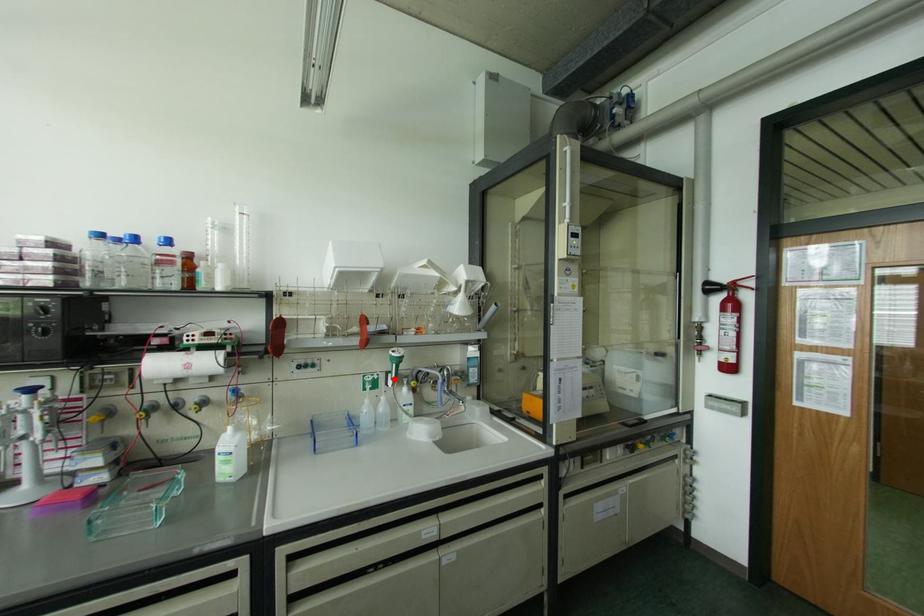
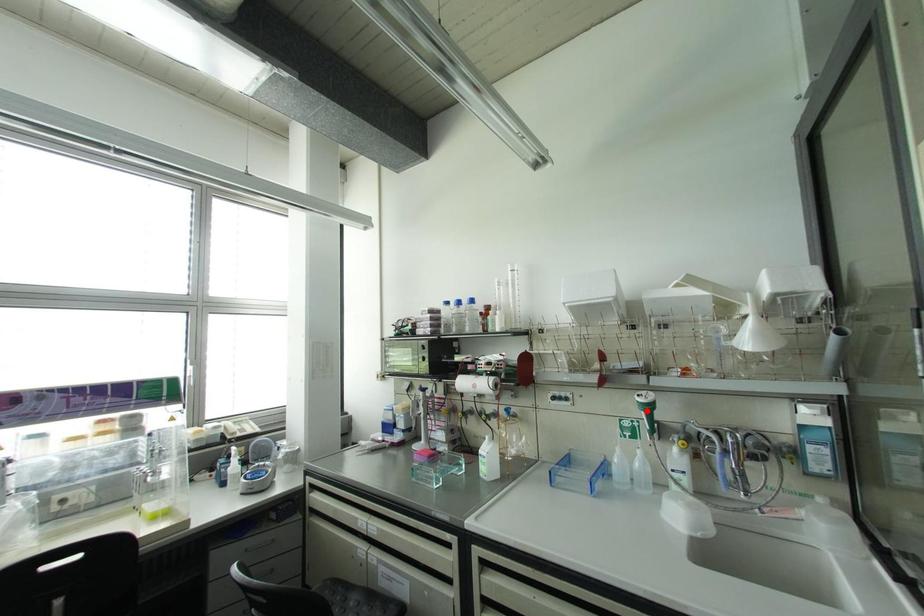
I am providing you with two images of the same scene from different viewpoints. A red point is marked on the first image and another point is marked on the second image. Do the highlighted points in image1 and image2 indicate the same real-world spot?

No